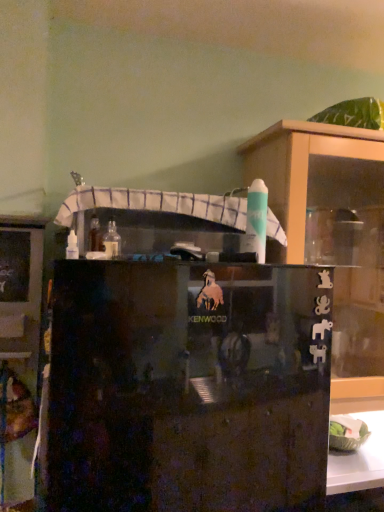
Question: Considering the relative sizes of transparent glass cupboard at upper right and clear glass bottle at center in the image provided, is transparent glass cupboard at upper right shorter than clear glass bottle at center?

Choices:
 (A) yes
 (B) no

Answer: (B)

Question: Is there a large distance between transparent glass cupboard at upper right and clear glass bottle at center?

Choices:
 (A) yes
 (B) no

Answer: (B)

Question: From a real-world perspective, is transparent glass cupboard at upper right located beneath clear glass bottle at center?

Choices:
 (A) no
 (B) yes

Answer: (B)

Question: From a real-world perspective, is transparent glass cupboard at upper right on clear glass bottle at center?

Choices:
 (A) no
 (B) yes

Answer: (A)

Question: Is transparent glass cupboard at upper right positioned with its back to clear glass bottle at center?

Choices:
 (A) no
 (B) yes

Answer: (A)

Question: Considering the positions of transparent glass cupboard at upper right and matte black cabinet at left, the 1th cabinetry viewed from the left, in the image, is transparent glass cupboard at upper right wider or thinner than matte black cabinet at left, the 1th cabinetry viewed from the left,?

Choices:
 (A) wide
 (B) thin

Answer: (A)

Question: Based on their positions, is transparent glass cupboard at upper right located to the left or right of matte black cabinet at left, the 1th cabinetry viewed from the left?

Choices:
 (A) left
 (B) right

Answer: (B)

Question: Is transparent glass cupboard at upper right taller or shorter than matte black cabinet at left, the 2th cabinetry when ordered from right to left?

Choices:
 (A) tall
 (B) short

Answer: (A)

Question: Does point (244, 177) appear closer or farther from the camera than point (0, 439)?

Choices:
 (A) closer
 (B) farther

Answer: (B)

Question: In terms of width, does matte black cabinet at left, the 1th cabinetry viewed from the left, look wider or thinner when compared to transparent glass cupboard at upper right?

Choices:
 (A) thin
 (B) wide

Answer: (A)

Question: From a real-world perspective, is matte black cabinet at left, the 2th cabinetry when ordered from right to left, positioned above or below transparent glass cupboard at upper right?

Choices:
 (A) above
 (B) below

Answer: (B)

Question: Would you say matte black cabinet at left, the 1th cabinetry viewed from the left, is to the left or to the right of transparent glass cupboard at upper right in the picture?

Choices:
 (A) left
 (B) right

Answer: (A)

Question: Looking at the image, does matte black cabinet at left, the 1th cabinetry viewed from the left, seem bigger or smaller compared to transparent glass cupboard at upper right?

Choices:
 (A) small
 (B) big

Answer: (A)

Question: Looking at their shapes, would you say black glossy cabinet at center, the 1th cabinetry positioned from the right, is wider or thinner than clear glass bottle at center?

Choices:
 (A) thin
 (B) wide

Answer: (B)

Question: Visually, is black glossy cabinet at center, the 1th cabinetry positioned from the right, positioned to the left or to the right of clear glass bottle at center?

Choices:
 (A) left
 (B) right

Answer: (B)